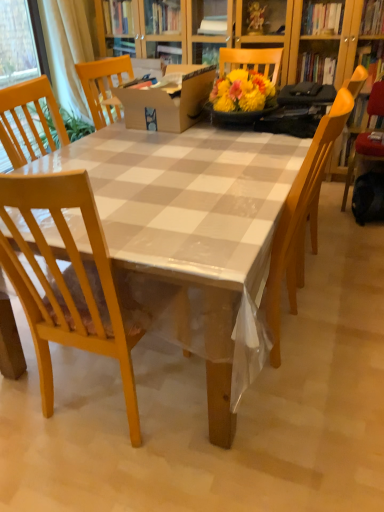
Question: Considering the positions of wooden chair at center, which appears as the second chair when viewed from the right, and white sheer curtain at upper left in the image, is wooden chair at center, which appears as the second chair when viewed from the right, wider or thinner than white sheer curtain at upper left?

Choices:
 (A) wide
 (B) thin

Answer: (A)

Question: Which is correct: wooden chair at center, which appears as the second chair when viewed from the right, is inside white sheer curtain at upper left, or outside of it?

Choices:
 (A) outside
 (B) inside

Answer: (A)

Question: Estimate the real-world distances between objects in this image. Which object is farther from the wooden chair at center, which appears as the second chair when viewed from the left?

Choices:
 (A) white sheer curtain at upper left
 (B) wooden table at center
 (C) cardboard box at center
 (D) light wood chair at left, the third chair when ordered from back to front
 (E) yellow wood chair at right, placed as the first chair when sorted from right to left

Answer: (A)

Question: Estimate the real-world distances between objects in this image. Which object is closer to the wooden table at center?

Choices:
 (A) cardboard box at center
 (B) wooden chair at center, placed as the 2th chair when sorted from back to front
 (C) light wood chair at left, arranged as the 1th chair when viewed from the left
 (D) white sheer curtain at upper left
 (E) yellow wood chair at right, the third chair in the front-to-back sequence

Answer: (C)